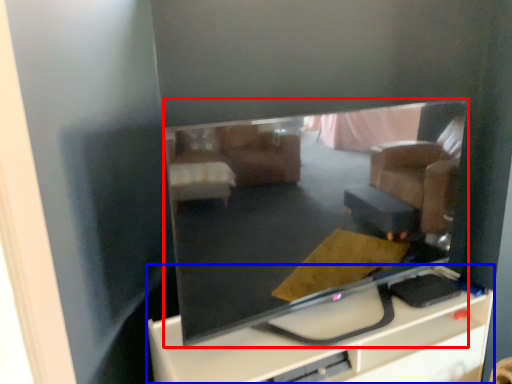
Question: Which object appears closest to the camera in this image, television (highlighted by a red box) or furniture (highlighted by a blue box)?

Choices:
 (A) television
 (B) furniture

Answer: (A)